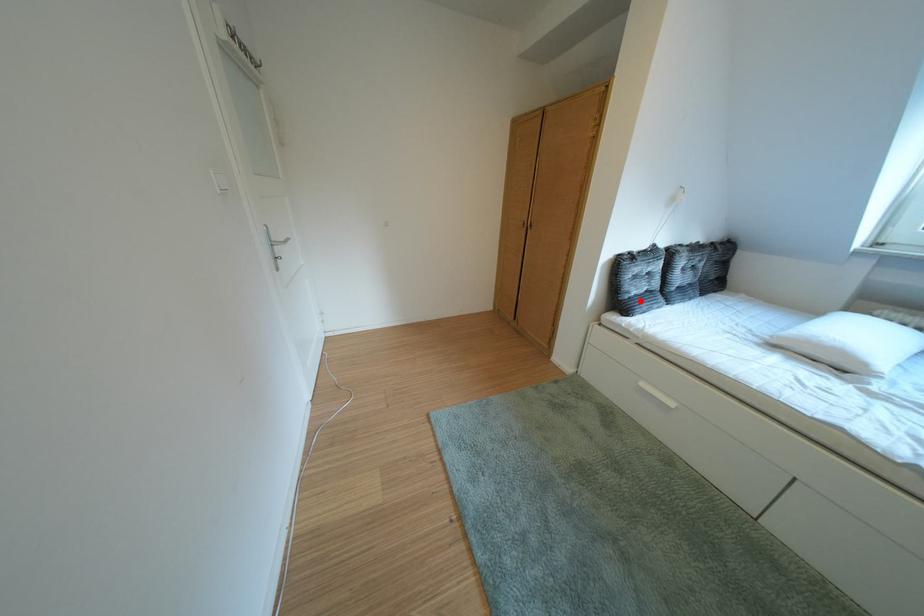
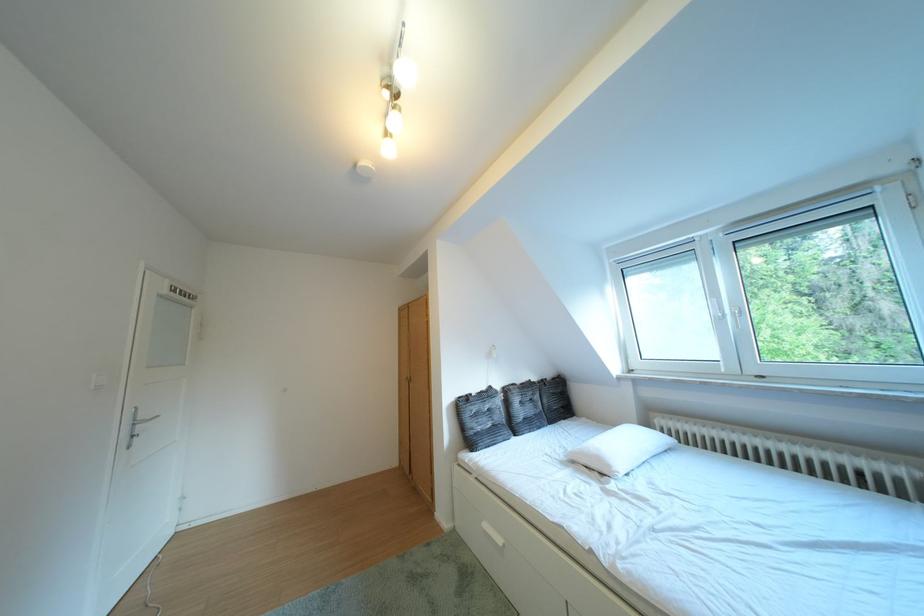
Question: I am providing you with two images of the same scene from different viewpoints. In image1, a red point is highlighted. Considering the same 3D point in image2, which of the following is correct?

Choices:
 (A) It is closer
 (B) It is farther

Answer: (B)